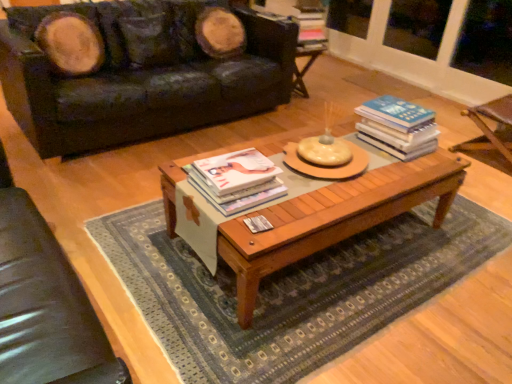
Question: Is matte white book at center, arranged as the second book when viewed from the top, smaller than wooden armchair at right, which ranks as the 2th armchair in left-to-right order?

Choices:
 (A) yes
 (B) no

Answer: (A)

Question: Does matte white book at center, the 2th book in the right-to-left sequence, have a greater height compared to wooden armchair at right, marked as the second armchair in a front-to-back arrangement?

Choices:
 (A) no
 (B) yes

Answer: (A)

Question: Is matte white book at center, which is counted as the 2th book, starting from the back, outside of wooden armchair at right, marked as the second armchair in a front-to-back arrangement?

Choices:
 (A) no
 (B) yes

Answer: (B)

Question: From the image's perspective, is matte white book at center, the first book when ordered from left to right, located above wooden armchair at right, positioned as the 1th armchair in right-to-left order?

Choices:
 (A) yes
 (B) no

Answer: (B)

Question: Considering the relative positions of matte white book at center, the first book when ordered from left to right, and wooden armchair at right, marked as the second armchair in a front-to-back arrangement, in the image provided, is matte white book at center, the first book when ordered from left to right, to the left of wooden armchair at right, marked as the second armchair in a front-to-back arrangement, from the viewer's perspective?

Choices:
 (A) yes
 (B) no

Answer: (A)

Question: From a real-world perspective, is matte white book at center, arranged as the first book when viewed from the front, located beneath wooden armchair at right, positioned as the 1th armchair in right-to-left order?

Choices:
 (A) yes
 (B) no

Answer: (B)

Question: Can you confirm if leather couch at upper left is thinner than wooden coffee table at center?

Choices:
 (A) no
 (B) yes

Answer: (A)

Question: Is leather couch at upper left outside wooden coffee table at center?

Choices:
 (A) yes
 (B) no

Answer: (A)

Question: Can wooden coffee table at center be found inside leather couch at upper left?

Choices:
 (A) no
 (B) yes

Answer: (A)

Question: Could you tell me if leather couch at upper left is turned towards wooden coffee table at center?

Choices:
 (A) no
 (B) yes

Answer: (B)

Question: From a real-world perspective, is leather couch at upper left on wooden coffee table at center?

Choices:
 (A) no
 (B) yes

Answer: (B)

Question: Is leather couch at upper left at the left side of wooden coffee table at center?

Choices:
 (A) yes
 (B) no

Answer: (A)

Question: Does leather couch at upper left contain wooden armchair at right, the 1th armchair in the back-to-front sequence?

Choices:
 (A) yes
 (B) no

Answer: (B)